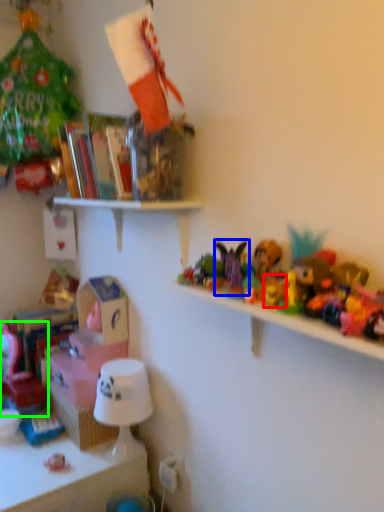
Question: Based on their relative distances, which object is nearer to toy (highlighted by a red box)? Choose from toy (highlighted by a blue box) and toy (highlighted by a green box).

Choices:
 (A) toy
 (B) toy

Answer: (A)